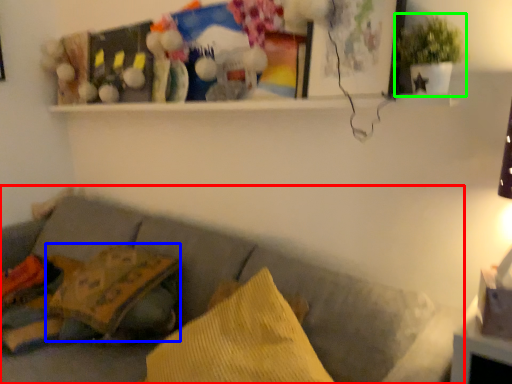
Question: Which is nearer to the studio couch (highlighted by a red box)? pillow (highlighted by a blue box) or houseplant (highlighted by a green box).

Choices:
 (A) pillow
 (B) houseplant

Answer: (A)